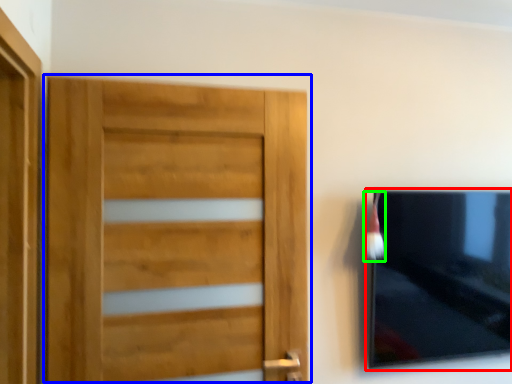
Question: Considering the real-world distances, which object is farthest from picture frame (highlighted by a red box)? door (highlighted by a blue box) or brush (highlighted by a green box)?

Choices:
 (A) door
 (B) brush

Answer: (A)